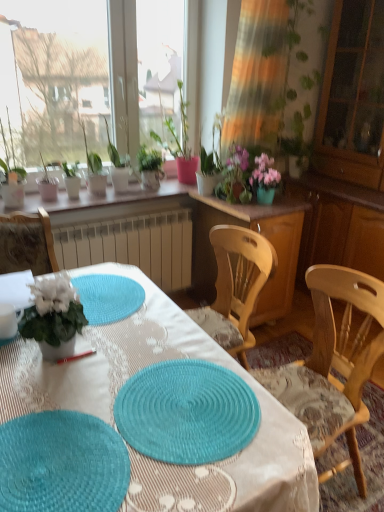
This screenshot has height=512, width=384. Identify the location of vacant space that's between teal woven mat at lower left, which is the 1th mat in left-to-right order, and teal woven placemat at center, arranged as the 1th mat when viewed from the right. 124,439.